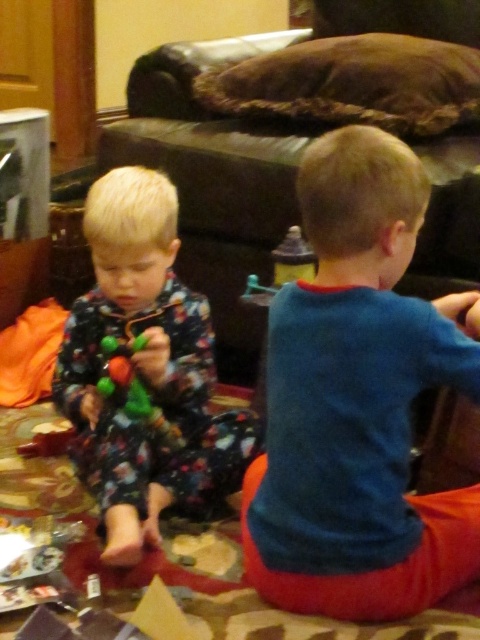
Question: From the image, what is the correct spatial relationship of floral pajamas at left in relation to shiny plastic toy at left?

Choices:
 (A) right
 (B) left

Answer: (A)

Question: Is blue cotton shirt at center smaller than shiny plastic toy at left?

Choices:
 (A) yes
 (B) no

Answer: (B)

Question: Which object is the closest to the blue cotton shirt at center?

Choices:
 (A) shiny plastic toy at left
 (B) floral pajamas at left

Answer: (B)

Question: Which object is farther from the camera taking this photo?

Choices:
 (A) floral pajamas at left
 (B) blue cotton shirt at center
 (C) shiny plastic toy at left

Answer: (C)

Question: Is the position of floral pajamas at left more distant than that of shiny plastic toy at left?

Choices:
 (A) yes
 (B) no

Answer: (B)

Question: Estimate the real-world distances between objects in this image. Which object is closer to the blue cotton shirt at center?

Choices:
 (A) shiny plastic toy at left
 (B) floral pajamas at left

Answer: (B)